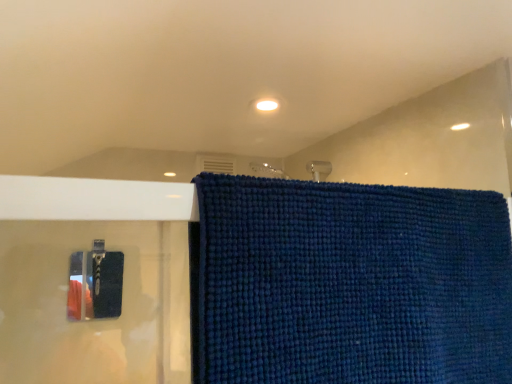
In the scene shown: In order to face dark blue textured towel at upper center, should I rotate leftwards or rightwards?

Rotate your view right by about 16.891°.

This screenshot has height=384, width=512. What do you see at coordinates (349, 283) in the screenshot?
I see `dark blue textured towel at upper center` at bounding box center [349, 283].

Where is `dark blue textured towel at upper center`? Image resolution: width=512 pixels, height=384 pixels. dark blue textured towel at upper center is located at coordinates (349, 283).

Measure the distance between dark blue textured towel at upper center and camera.

dark blue textured towel at upper center is 20.21 inches away from camera.

This screenshot has width=512, height=384. What are the coordinates of `dark blue textured towel at upper center` in the screenshot? It's located at (349, 283).